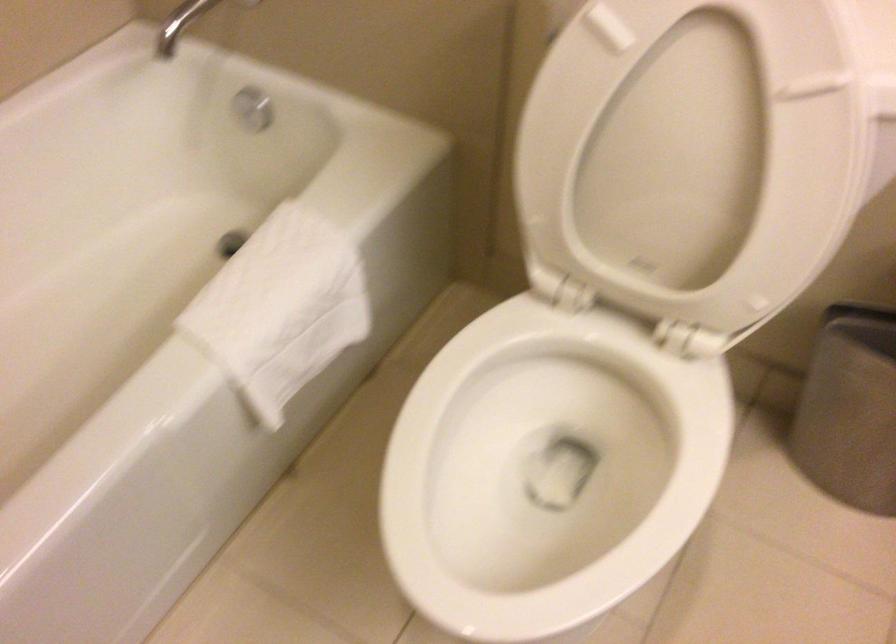
The image size is (896, 644). What do you see at coordinates (230, 242) in the screenshot?
I see `the bathtub drain lever` at bounding box center [230, 242].